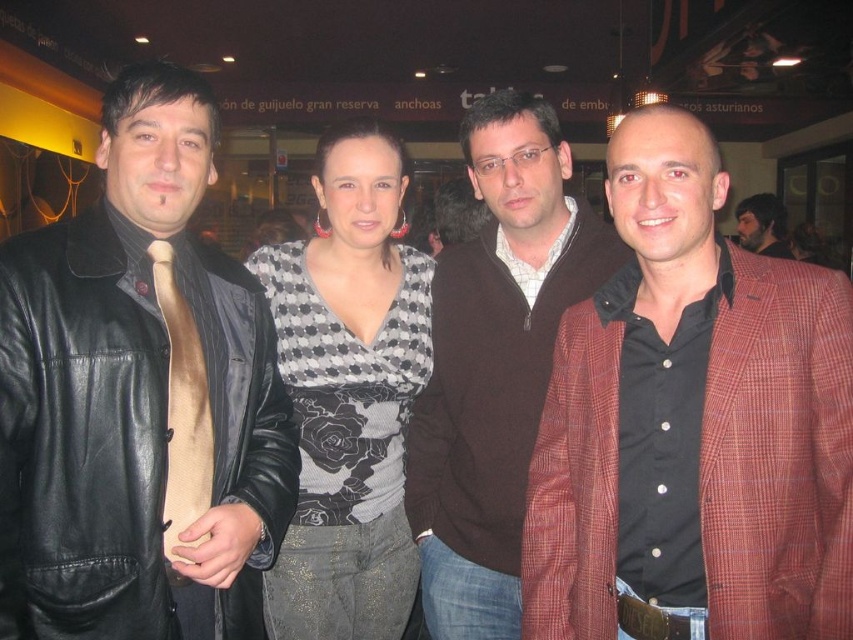
You are a photographer at the event and want to ensure all attendees can be seen in the group photo. Given the black leather jacket at left and the checkered fabric top at center, which one is smaller in size to allow more attendees to fit into the frame?

The black leather jacket at left occupies less space than the checkered fabric top at center, so it is smaller in size and would allow more attendees to fit into the frame.

You are a photographer at a Spanish themed event. You notice the black leather jacket at left and the checkered fabric top at center. Which one is positioned lower in the image?

The black leather jacket at left is positioned lower than the checkered fabric top at center in the image.

You are at a Spanish themed restaurant and see two guests wearing jackets. The guests are the man in the black leather jacket at left and the woman in the plaid wool blazer at right. Which jacket is positioned farther to the right?

The plaid wool blazer at right is positioned farther to the right than the black leather jacket at left.